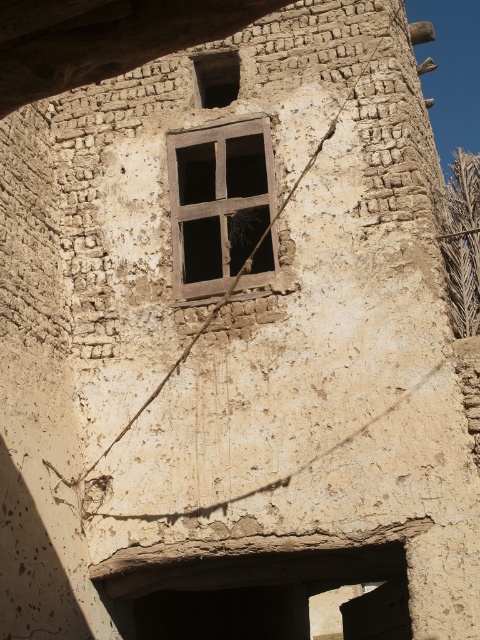
I want to click on wooden window at center, so click(217, 202).

Locate an element on the screen. This screenshot has height=640, width=480. wooden window at center is located at coordinates click(217, 202).

This screenshot has width=480, height=640. In order to click on wooden window at center in this screenshot , I will do `click(217, 202)`.